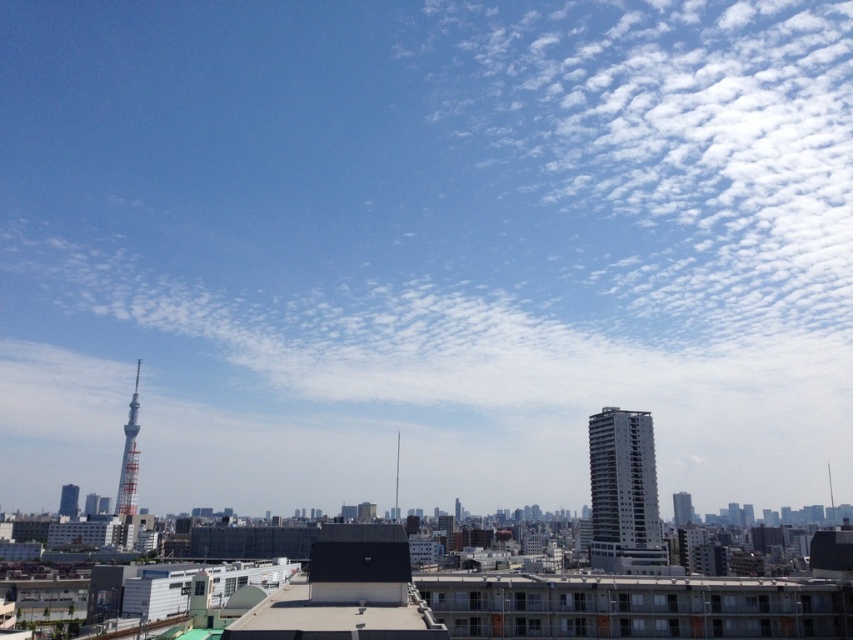
Does white fluffy cloud at upper right come in front of metallic silver tower at left?

No, it is not.

Does point (694, 10) come farther from viewer compared to point (120, 465)?

That is True.

You are a GUI agent. You are given a task and a screenshot of the screen. Output one action in this format:
    pyautogui.click(x=<x>, y=<y>)
    Task: Click on the white fluffy cloud at upper right
    The height and width of the screenshot is (640, 853).
    Given the screenshot: What is the action you would take?
    pyautogui.click(x=642, y=156)

Between white concrete building at right and metallic silver tower at left, which one appears on the left side from the viewer's perspective?

From the viewer's perspective, metallic silver tower at left appears more on the left side.

Who is lower down, white concrete building at right or metallic silver tower at left?

Positioned lower is white concrete building at right.

Identify the location of white concrete building at right. (624, 490).

Identify the location of white concrete building at right. (624, 490).

Can you confirm if white fluffy cloud at upper right is positioned below white concrete building at right?

Incorrect, white fluffy cloud at upper right is not positioned below white concrete building at right.

At what (x,y) coordinates should I click in order to perform the action: click on white fluffy cloud at upper right. Please return your answer as a coordinate pair (x, y). Looking at the image, I should click on (642, 156).

You are a GUI agent. You are given a task and a screenshot of the screen. Output one action in this format:
    pyautogui.click(x=<x>, y=<y>)
    Task: Click on the white fluffy cloud at upper right
    
    Given the screenshot: What is the action you would take?
    pyautogui.click(x=642, y=156)